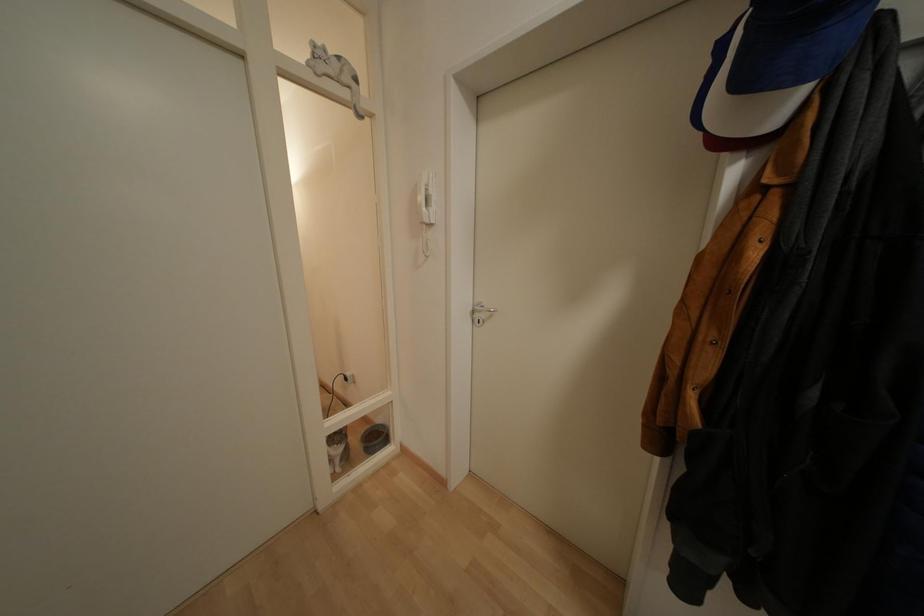
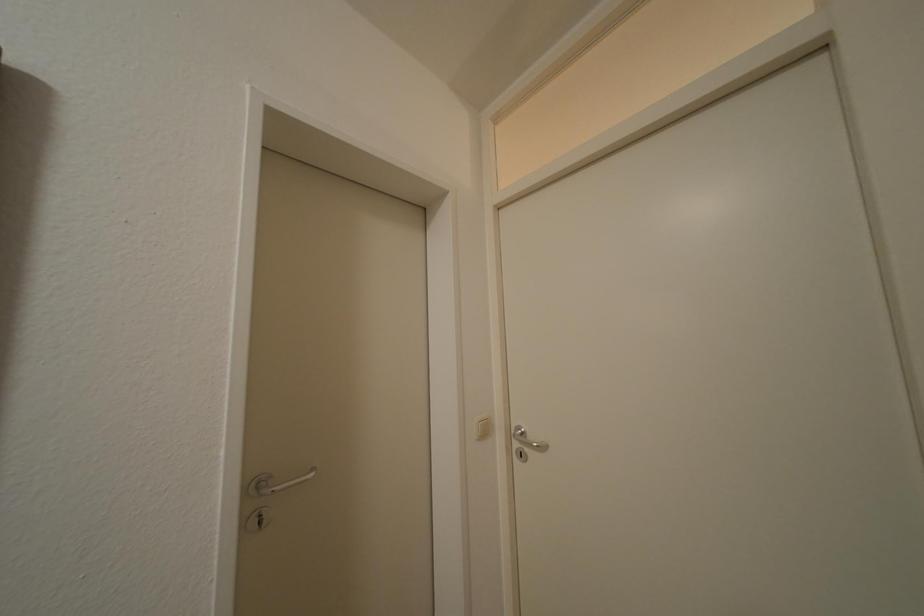
Question: The camera is either moving clockwise (left) or counter-clockwise (right) around the object. The first image is from the beginning of the video and the second image is from the end. Is the camera moving left or right when shooting the video?

Choices:
 (A) Left
 (B) Right

Answer: (B)